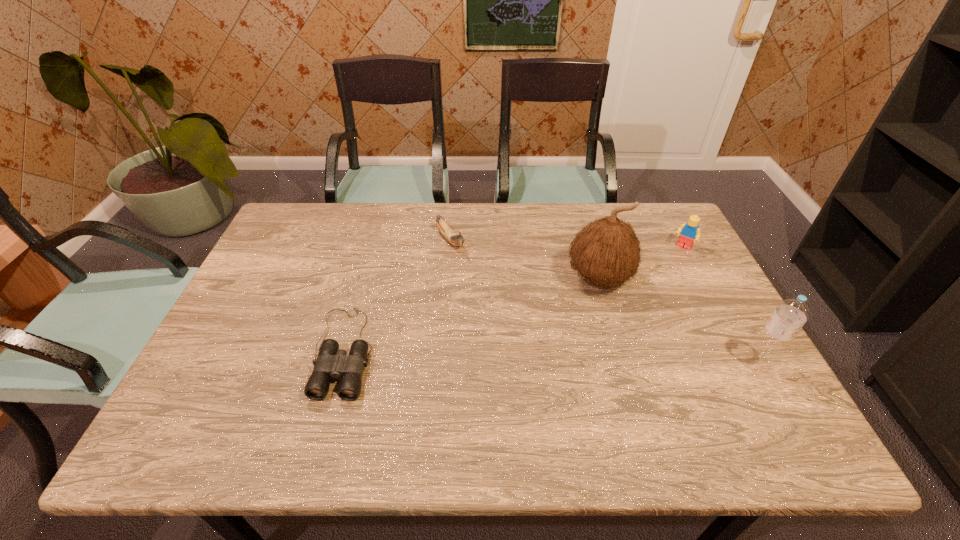
The width and height of the screenshot is (960, 540). What are the coordinates of `object that is at the near edge` in the screenshot? It's located at (332, 362).

Where is `water bottle situated at the right edge`? This screenshot has height=540, width=960. water bottle situated at the right edge is located at coordinates (790, 315).

Identify the location of Lego at the right edge. (689, 232).

At what (x,y) coordinates should I click in order to perform the action: click on object located in the far right corner section of the desktop. Please return your answer as a coordinate pair (x, y). The height and width of the screenshot is (540, 960). Looking at the image, I should click on (689, 232).

Identify the location of vacant space at the far edge of the desktop. (421, 222).

You are a GUI agent. You are given a task and a screenshot of the screen. Output one action in this format:
    pyautogui.click(x=<x>, y=<y>)
    Task: Click on the free space at the near edge of the desktop
    
    Given the screenshot: What is the action you would take?
    pyautogui.click(x=384, y=409)

Image resolution: width=960 pixels, height=540 pixels. I want to click on free space at the left edge, so click(x=251, y=365).

You are a GUI agent. You are given a task and a screenshot of the screen. Output one action in this format:
    pyautogui.click(x=<x>, y=<y>)
    Task: Click on the vacant position at the right edge of the desktop
    This screenshot has width=960, height=540.
    Given the screenshot: What is the action you would take?
    pyautogui.click(x=687, y=341)

Locate an element on the screen. Image resolution: width=960 pixels, height=540 pixels. blank area at the far left corner is located at coordinates [x=276, y=238].

The height and width of the screenshot is (540, 960). I want to click on free point at the near left corner, so click(238, 379).